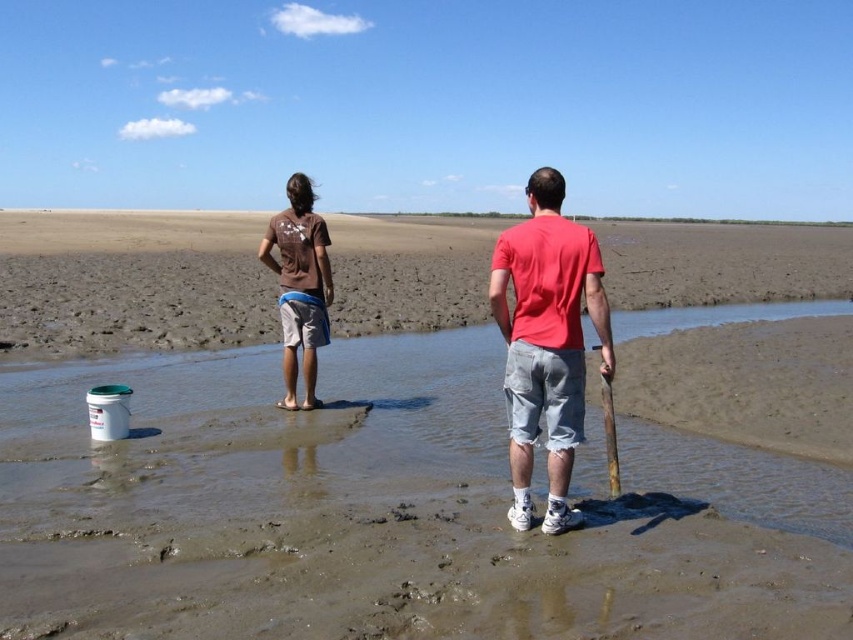
Question: Considering the real-world distances, which object is farthest from the muddy sand at center?

Choices:
 (A) brown sand at center
 (B) brown cotton shirt at center
 (C) matte red t-shirt at center

Answer: (B)

Question: Which point is closer to the camera taking this photo?

Choices:
 (A) (59, 314)
 (B) (413, 484)
 (C) (314, 218)

Answer: (B)

Question: Which object is the farthest from the brown cotton shirt at center?

Choices:
 (A) matte red t-shirt at center
 (B) brown sand at center
 (C) muddy sand at center

Answer: (C)

Question: Does brown sand at center lie behind matte red t-shirt at center?

Choices:
 (A) no
 (B) yes

Answer: (A)

Question: Does brown sand at center have a lesser width compared to matte red t-shirt at center?

Choices:
 (A) yes
 (B) no

Answer: (B)

Question: Is matte red t-shirt at center positioned in front of brown cotton shirt at center?

Choices:
 (A) no
 (B) yes

Answer: (B)